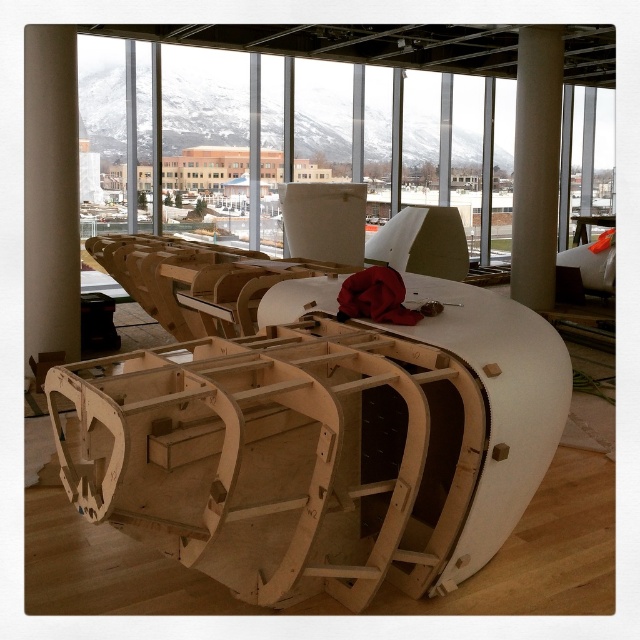
Between point (396, 502) and point (35, 74), which one is positioned in front?

Point (396, 502) is more forward.

Can you confirm if natural wood boat at center is positioned below beige smooth pillar at left?

Correct, natural wood boat at center is located below beige smooth pillar at left.

The image size is (640, 640). Find the location of `natural wood boat at center`. natural wood boat at center is located at coordinates (312, 420).

Locate an element on the screen. The height and width of the screenshot is (640, 640). natural wood boat at center is located at coordinates (312, 420).

Who is lower down, natural wood boat at center or white smooth column at center?

natural wood boat at center is lower down.

You are a GUI agent. You are given a task and a screenshot of the screen. Output one action in this format:
    pyautogui.click(x=<x>, y=<y>)
    Task: Click on the natural wood boat at center
    The width and height of the screenshot is (640, 640).
    Given the screenshot: What is the action you would take?
    pyautogui.click(x=312, y=420)

Is beige smooth pillar at left to the left of white smooth column at center from the viewer's perspective?

Yes, beige smooth pillar at left is to the left of white smooth column at center.

Find the location of a particular element. beige smooth pillar at left is located at coordinates (51, 193).